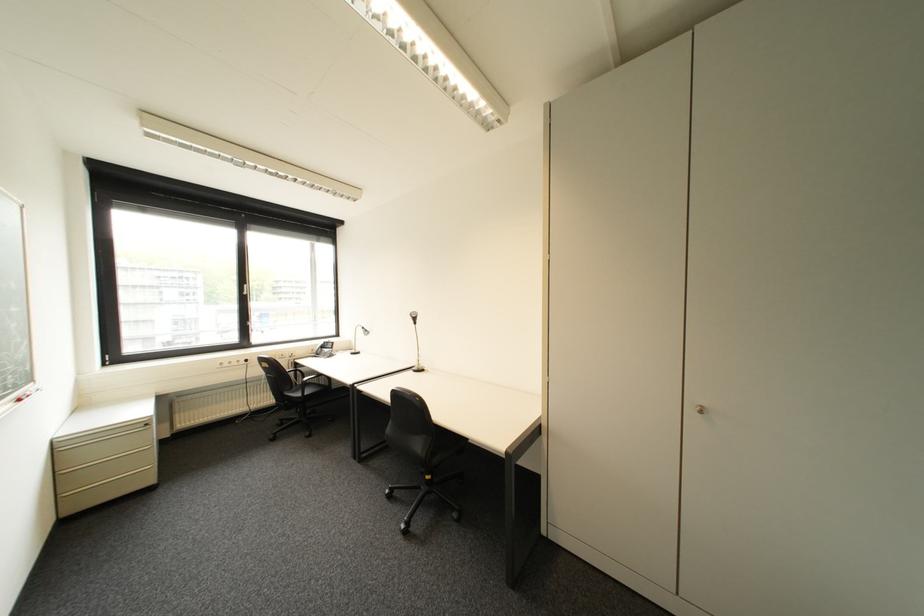
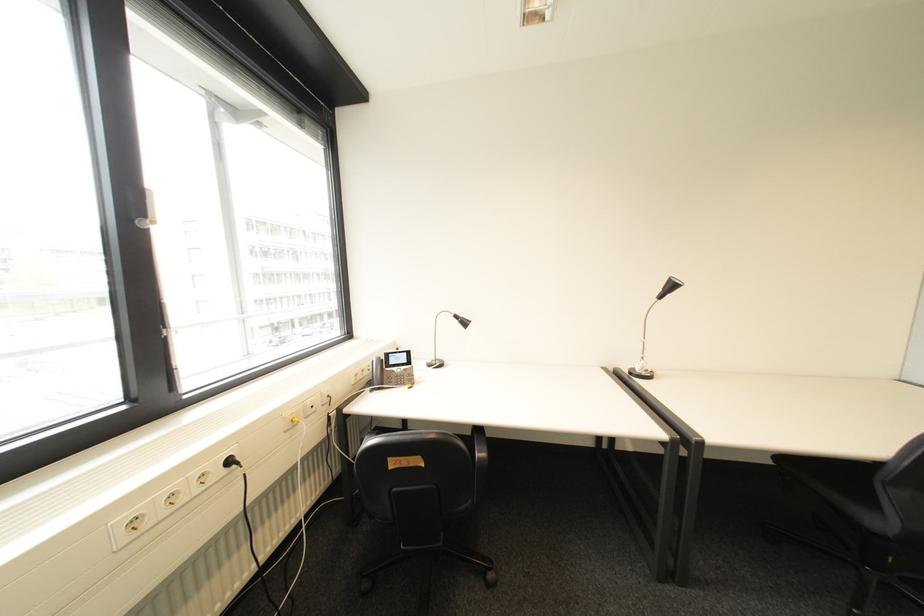
Find the pixel in the second image that matches point (257, 361) in the first image.

(239, 463)